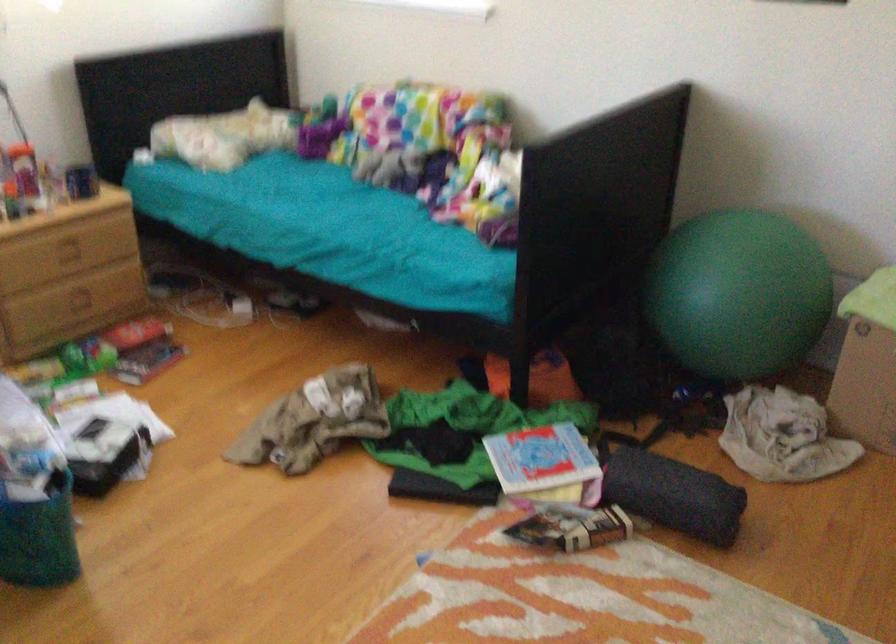
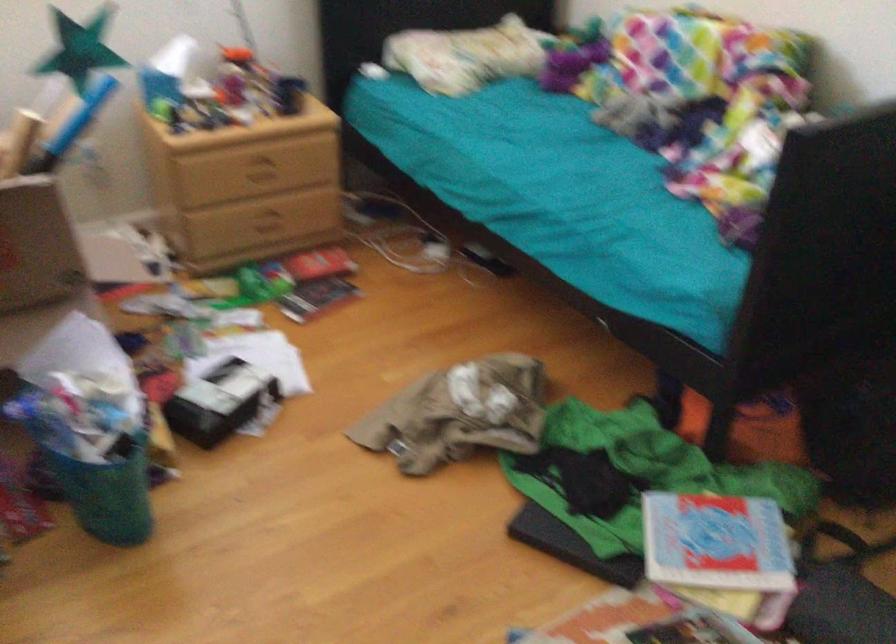
Locate, in the second image, the point that corresponds to [85,297] in the first image.

(268, 222)